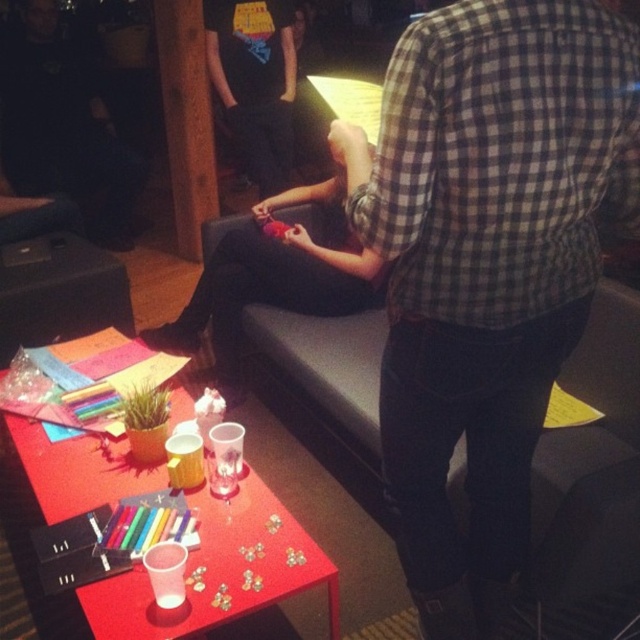
You are taking a photo of the scene. You want to focus on the point that is closer to the camera. Which point should you choose between point (561, 234) and point (180, 177)?

Point (561, 234) is closer to the camera than point (180, 177), so you should focus on point (561, 234).